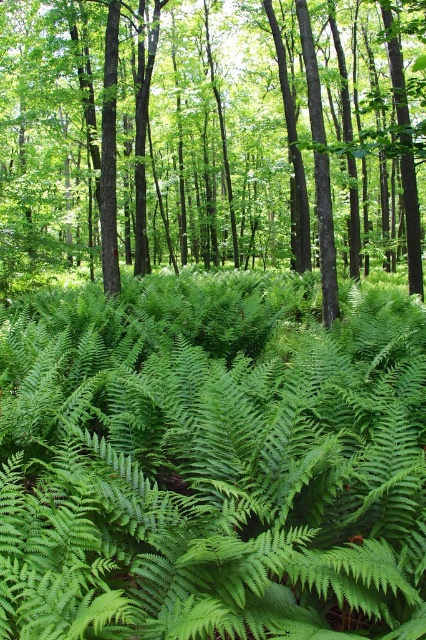
Question: Is green leafy fern at center wider than green leafy fern at lower center?

Choices:
 (A) no
 (B) yes

Answer: (A)

Question: Is green leafy fern at center to the left of green leafy fern at lower center from the viewer's perspective?

Choices:
 (A) no
 (B) yes

Answer: (A)

Question: Which object is closer to the camera taking this photo?

Choices:
 (A) green leafy fern at center
 (B) green leafy fern at lower center

Answer: (A)

Question: Does green leafy fern at center appear on the left side of green leafy fern at lower center?

Choices:
 (A) yes
 (B) no

Answer: (B)

Question: Which point is closer to the camera?

Choices:
 (A) green leafy fern at lower center
 (B) green leafy fern at center

Answer: (B)